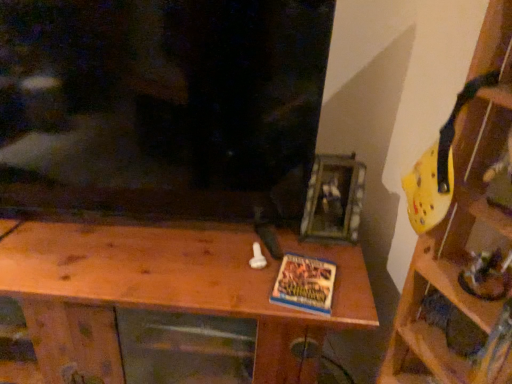
Image resolution: width=512 pixels, height=384 pixels. In order to click on vacant space that is to the left of blue matte book at center in this screenshot , I will do `click(241, 276)`.